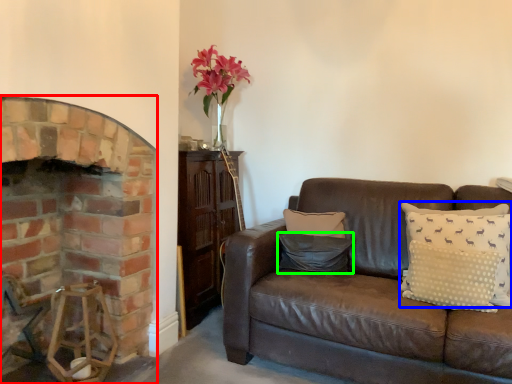
Question: Based on their relative distances, which object is farther from fireplace (highlighted by a red box)? Choose from pillow (highlighted by a blue box) and pillow (highlighted by a green box).

Choices:
 (A) pillow
 (B) pillow

Answer: (A)